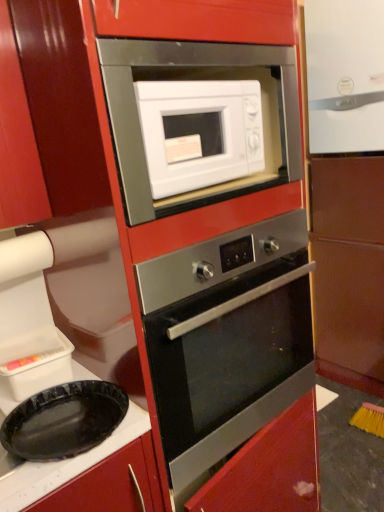
Question: From a real-world perspective, is matte brown cabinet at right located beneath white glossy refrigerator at upper right?

Choices:
 (A) yes
 (B) no

Answer: (A)

Question: Is matte brown cabinet at right to the right of white glossy refrigerator at upper right from the viewer's perspective?

Choices:
 (A) yes
 (B) no

Answer: (A)

Question: From the image's perspective, is matte brown cabinet at right located beneath white glossy refrigerator at upper right?

Choices:
 (A) yes
 (B) no

Answer: (A)

Question: Is matte brown cabinet at right looking in the opposite direction of white glossy refrigerator at upper right?

Choices:
 (A) no
 (B) yes

Answer: (B)

Question: Is matte brown cabinet at right not near white glossy refrigerator at upper right?

Choices:
 (A) yes
 (B) no

Answer: (B)

Question: Can you confirm if matte brown cabinet at right is wider than white glossy refrigerator at upper right?

Choices:
 (A) yes
 (B) no

Answer: (A)

Question: Is stainless steel oven at center positioned behind black plastic plate at lower left?

Choices:
 (A) no
 (B) yes

Answer: (B)

Question: Considering the relative sizes of stainless steel oven at center and black plastic plate at lower left in the image provided, is stainless steel oven at center shorter than black plastic plate at lower left?

Choices:
 (A) yes
 (B) no

Answer: (B)

Question: Is stainless steel oven at center to the left of black plastic plate at lower left from the viewer's perspective?

Choices:
 (A) no
 (B) yes

Answer: (A)

Question: From the image's perspective, would you say stainless steel oven at center is shown under black plastic plate at lower left?

Choices:
 (A) no
 (B) yes

Answer: (A)

Question: Is stainless steel oven at center far away from black plastic plate at lower left?

Choices:
 (A) yes
 (B) no

Answer: (B)

Question: Does stainless steel oven at center have a smaller size compared to black plastic plate at lower left?

Choices:
 (A) no
 (B) yes

Answer: (A)

Question: From the image's perspective, is black plastic plate at lower left located above stainless steel oven at center?

Choices:
 (A) no
 (B) yes

Answer: (A)